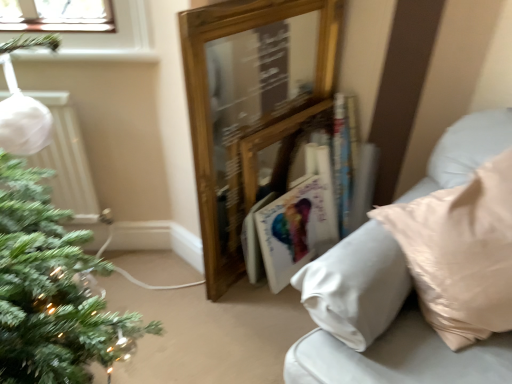
Question: Is the depth of white glossy magazine at center less than that of white matte radiator at left?

Choices:
 (A) yes
 (B) no

Answer: (B)

Question: Is white matte radiator at left completely or partially inside white glossy magazine at center?

Choices:
 (A) yes
 (B) no

Answer: (B)

Question: Is white glossy magazine at center facing away from white matte radiator at left?

Choices:
 (A) no
 (B) yes

Answer: (A)

Question: Can you confirm if white glossy magazine at center is bigger than white matte radiator at left?

Choices:
 (A) no
 (B) yes

Answer: (A)

Question: Is white glossy magazine at center thinner than white matte radiator at left?

Choices:
 (A) yes
 (B) no

Answer: (B)

Question: From the image's perspective, is white glossy magazine at center below white matte radiator at left?

Choices:
 (A) yes
 (B) no

Answer: (A)

Question: Is white matte radiator at left not within white glossy magazine at center?

Choices:
 (A) yes
 (B) no

Answer: (A)

Question: Does white matte radiator at left have a smaller size compared to white glossy magazine at center?

Choices:
 (A) yes
 (B) no

Answer: (B)

Question: Can you confirm if white matte radiator at left is positioned to the left of white glossy magazine at center?

Choices:
 (A) no
 (B) yes

Answer: (B)

Question: From the image's perspective, does white matte radiator at left appear higher than white glossy magazine at center?

Choices:
 (A) yes
 (B) no

Answer: (A)

Question: Is white matte radiator at left in front of white glossy magazine at center?

Choices:
 (A) yes
 (B) no

Answer: (A)

Question: Is white matte radiator at left directly adjacent to white glossy magazine at center?

Choices:
 (A) yes
 (B) no

Answer: (B)

Question: Can you confirm if white matte radiator at left is bigger than hardcover book at center?

Choices:
 (A) no
 (B) yes

Answer: (A)